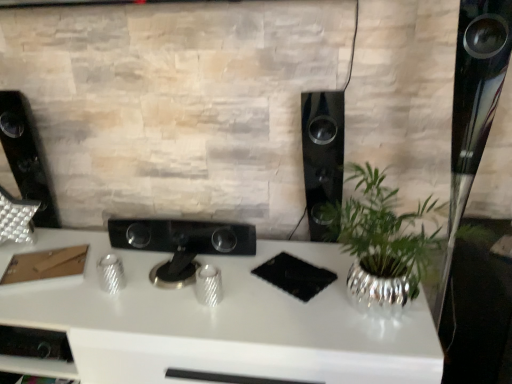
The image size is (512, 384). Identify the location of free space in front of black glossy speaker at center-right, placed as the first speaker when sorted from right to left. (324, 267).